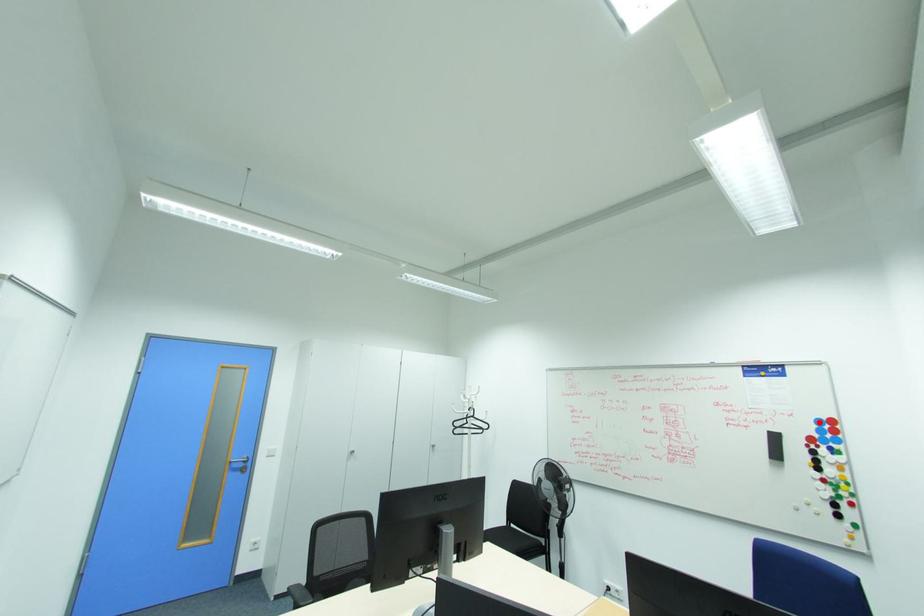
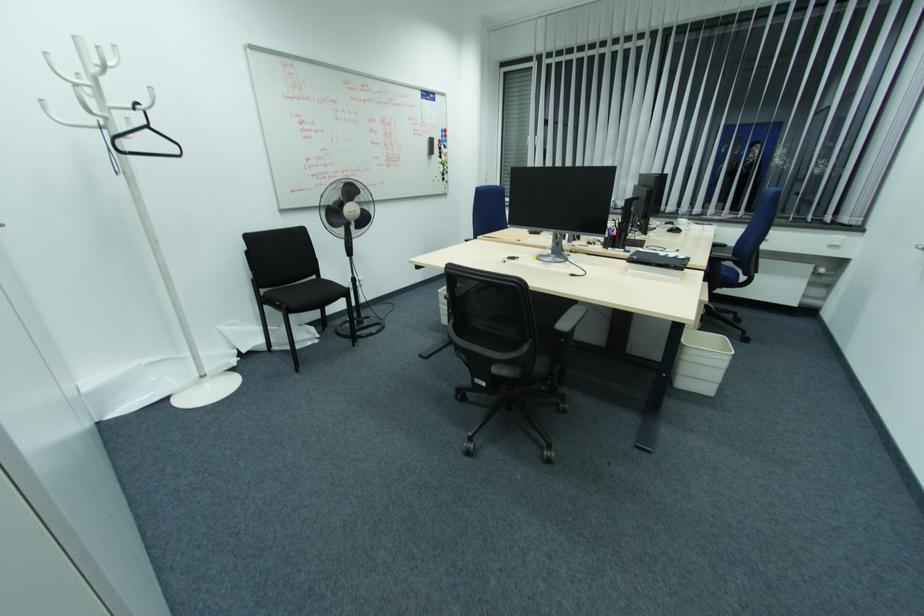
Locate, in the second image, the point that corresponds to the highlighted location in the first image.

(444, 131)